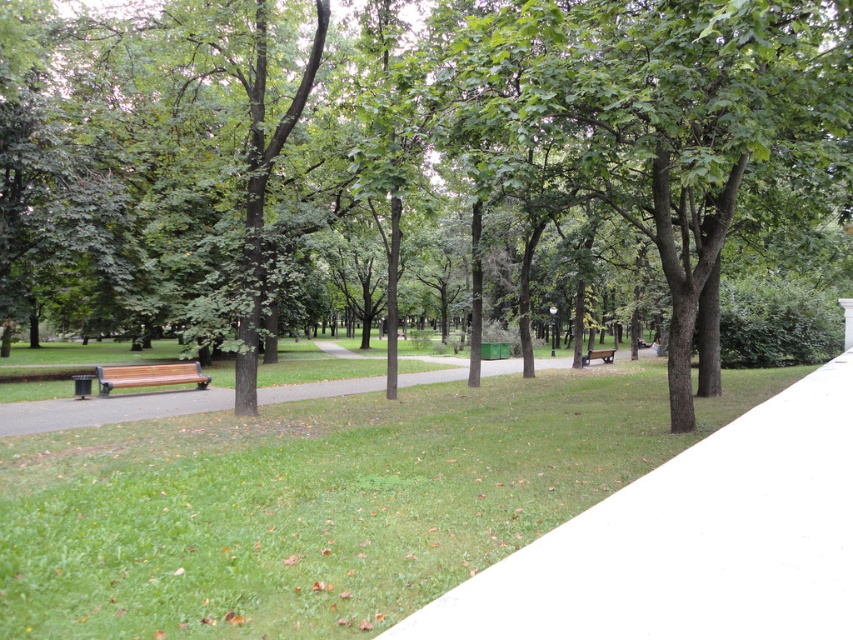
Question: Which object is positioned closest to the white smooth pavement at center?

Choices:
 (A) wooden bench at center
 (B) green leafy tree at center
 (C) wooden bench at left

Answer: (C)

Question: Is white smooth pavement at center to the right of wooden bench at center from the viewer's perspective?

Choices:
 (A) yes
 (B) no

Answer: (B)

Question: Which point is farther to the camera?

Choices:
 (A) white smooth pavement at center
 (B) wooden bench at center
 (C) green leafy tree at center
 (D) wooden bench at left

Answer: (B)

Question: Does white smooth pavement at center lie behind wooden bench at left?

Choices:
 (A) yes
 (B) no

Answer: (B)

Question: Is green leafy tree at center positioned behind wooden bench at center?

Choices:
 (A) no
 (B) yes

Answer: (A)

Question: Which is farther from the white smooth pavement at center?

Choices:
 (A) wooden bench at left
 (B) wooden bench at center
 (C) green leafy tree at center

Answer: (B)